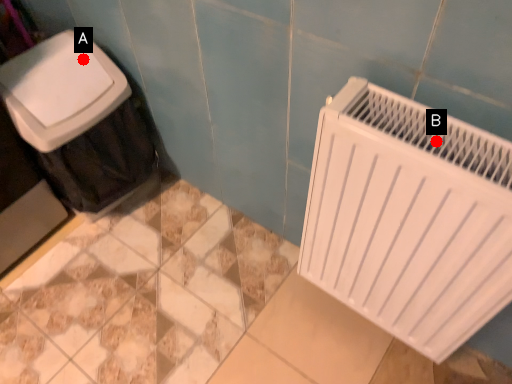
Question: Two points are circled on the image, labeled by A and B beside each circle. Which point is closer to the camera taking this photo?

Choices:
 (A) A is closer
 (B) B is closer

Answer: (B)